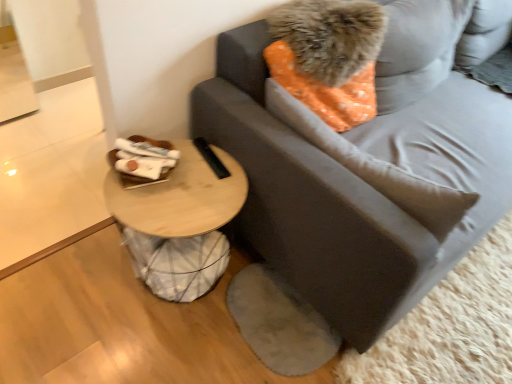
Question: Can you confirm if woodenmaterial/texturetable at lower left is smaller than gray fabric studio couch at center?

Choices:
 (A) no
 (B) yes

Answer: (B)

Question: From a real-world perspective, does woodenmaterial/texturetable at lower left stand above gray fabric studio couch at center?

Choices:
 (A) no
 (B) yes

Answer: (A)

Question: Is gray fabric studio couch at center completely or partially inside woodenmaterial/texturetable at lower left?

Choices:
 (A) yes
 (B) no

Answer: (B)

Question: Is woodenmaterial/texturetable at lower left positioned beyond the bounds of gray fabric studio couch at center?

Choices:
 (A) yes
 (B) no

Answer: (A)

Question: Considering the relative sizes of woodenmaterial/texturetable at lower left and gray fabric studio couch at center in the image provided, is woodenmaterial/texturetable at lower left bigger than gray fabric studio couch at center?

Choices:
 (A) yes
 (B) no

Answer: (B)

Question: Is orange dotted fabric pillow at upper right, which is counted as the 2th pillow, starting from the bottom, in front of or behind woodenmaterial/texturetable at lower left in the image?

Choices:
 (A) front
 (B) behind

Answer: (B)

Question: Would you say orange dotted fabric pillow at upper right, which is counted as the 2th pillow, starting from the bottom, is inside or outside woodenmaterial/texturetable at lower left?

Choices:
 (A) outside
 (B) inside

Answer: (A)

Question: From a real-world perspective, is orange dotted fabric pillow at upper right, the first pillow positioned from the top, physically located above or below woodenmaterial/texturetable at lower left?

Choices:
 (A) above
 (B) below

Answer: (A)

Question: Based on their sizes in the image, would you say orange dotted fabric pillow at upper right, which is counted as the 2th pillow, starting from the bottom, is bigger or smaller than woodenmaterial/texturetable at lower left?

Choices:
 (A) big
 (B) small

Answer: (B)

Question: Looking at their shapes, would you say gray fabric pillow at upper right, the 1th pillow when ordered from bottom to top, is wider or thinner than gray fabric studio couch at center?

Choices:
 (A) wide
 (B) thin

Answer: (B)

Question: From the image's perspective, is gray fabric pillow at upper right, the 1th pillow when ordered from bottom to top, located above or below gray fabric studio couch at center?

Choices:
 (A) above
 (B) below

Answer: (B)

Question: Is point (365, 130) positioned closer to the camera than point (424, 281)?

Choices:
 (A) closer
 (B) farther

Answer: (B)

Question: Is gray fabric pillow at upper right, acting as the 2th pillow starting from the top, spatially inside gray fabric studio couch at center, or outside of it?

Choices:
 (A) outside
 (B) inside

Answer: (B)

Question: Would you say woodenmaterial/texturetable at lower left is inside or outside gray fabric pillow at upper right, the 1th pillow when ordered from bottom to top?

Choices:
 (A) inside
 (B) outside

Answer: (B)

Question: Considering the positions of woodenmaterial/texturetable at lower left and gray fabric pillow at upper right, the 1th pillow when ordered from bottom to top, in the image, is woodenmaterial/texturetable at lower left bigger or smaller than gray fabric pillow at upper right, the 1th pillow when ordered from bottom to top,?

Choices:
 (A) small
 (B) big

Answer: (B)